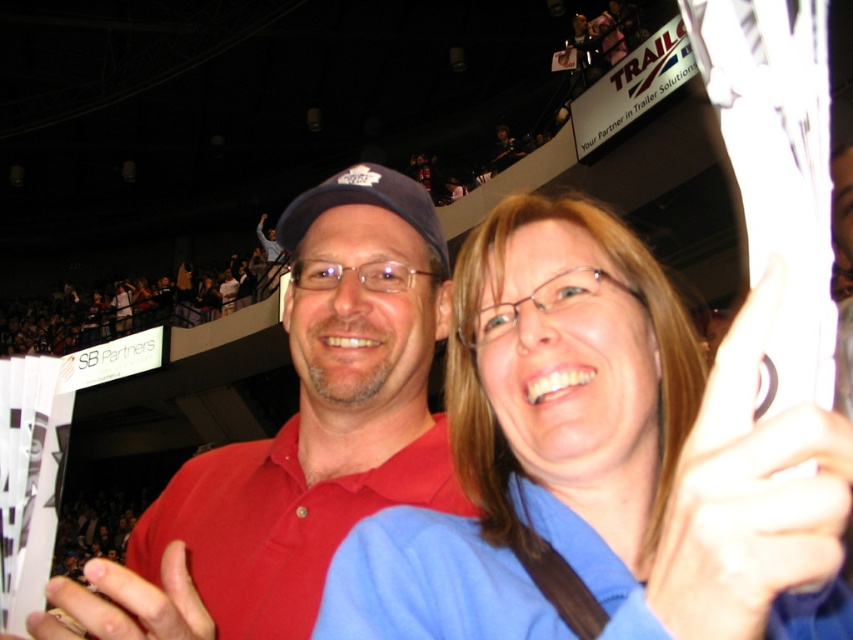
Question: Does blue fabric shirt at center come in front of matte red shirt at center?

Choices:
 (A) no
 (B) yes

Answer: (B)

Question: Can you confirm if blue fabric shirt at center is positioned below matte red shirt at center?

Choices:
 (A) yes
 (B) no

Answer: (A)

Question: Among these objects, which one is farthest from the camera?

Choices:
 (A) matte red shirt at center
 (B) blue fabric shirt at center

Answer: (A)

Question: Does blue fabric shirt at center come behind matte red shirt at center?

Choices:
 (A) yes
 (B) no

Answer: (B)

Question: Which point is closer to the camera?

Choices:
 (A) (331, 365)
 (B) (462, 435)

Answer: (B)